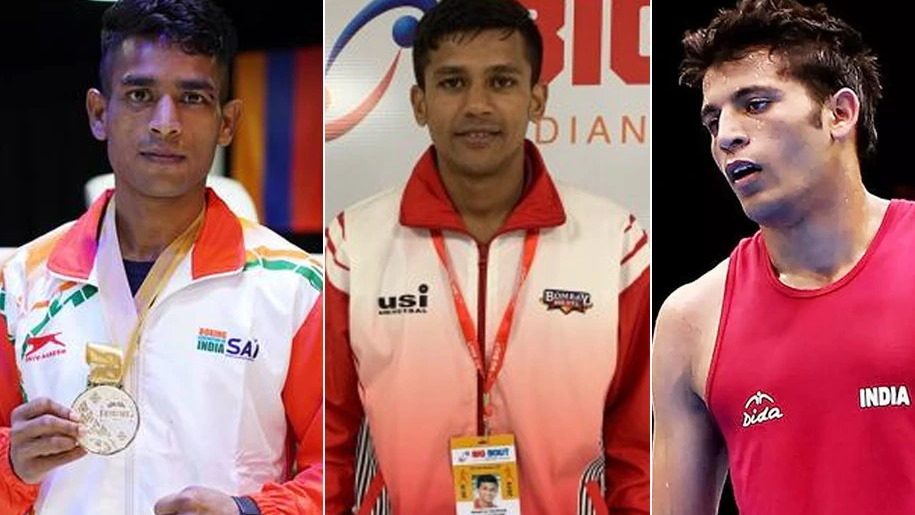
At what (x,y) coordinates should I click in order to perform the action: click on photographs. Please return your answer as a coordinate pair (x, y). Looking at the image, I should click on (222, 319), (468, 330), (778, 317).